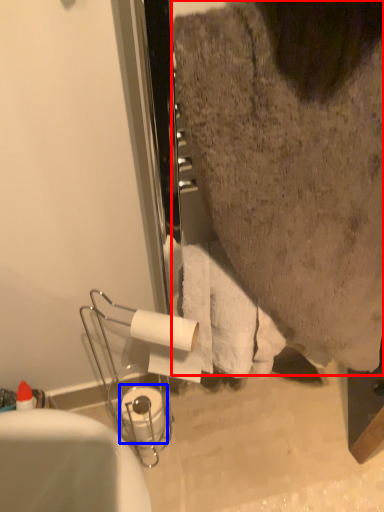
Question: Which of the following is the closest to the observer, person (highlighted by a red box) or toilet paper (highlighted by a blue box)?

Choices:
 (A) person
 (B) toilet paper

Answer: (A)